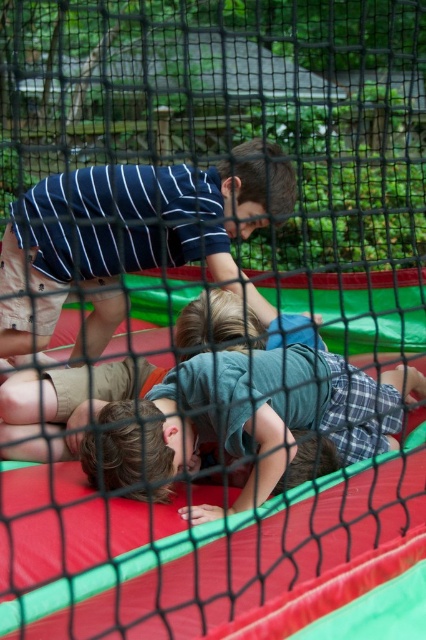
Can you confirm if green cotton shirt at center is positioned to the right of striped cotton shirt at upper center?

Yes, green cotton shirt at center is to the right of striped cotton shirt at upper center.

Who is shorter, green cotton shirt at center or striped cotton shirt at upper center?

Standing shorter between the two is green cotton shirt at center.

The width and height of the screenshot is (426, 640). Describe the element at coordinates (250, 420) in the screenshot. I see `green cotton shirt at center` at that location.

Find the location of a particular element. This screenshot has height=640, width=426. green cotton shirt at center is located at coordinates (250, 420).